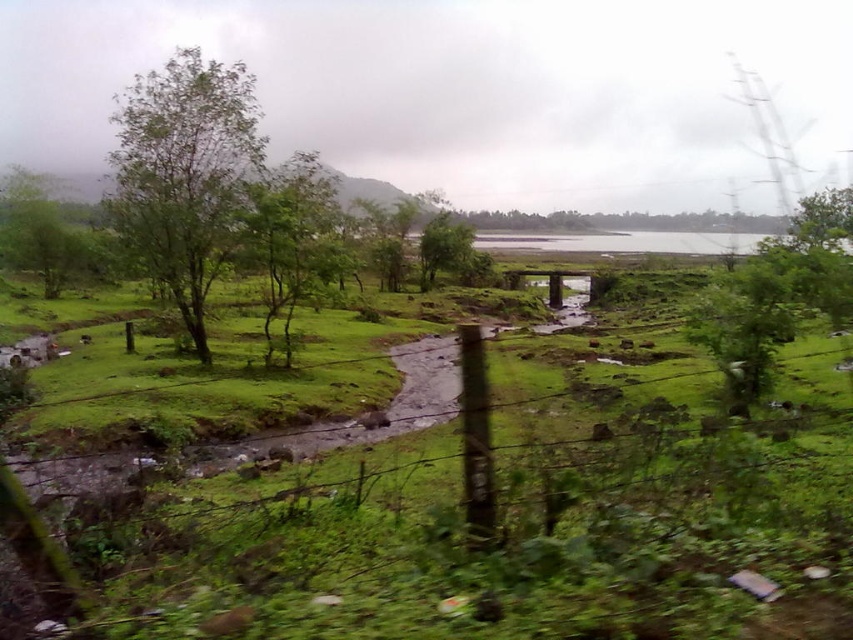
You are standing at the point marked as point (183, 173) in the image. Looking around, you see a green leafy tree at left and a barbed wire fence running diagonally across the middle ground. Which object is closer to you?

The green leafy tree at left is closer to you since the point (183, 173) is on it, whereas the barbed wire fence is further away in the middle ground.

You are standing at the center of the image and want to reach the green leafy tree at left. Which direction should you move in to get there?

To reach the green leafy tree at left, you should move to the left since it is located at point 0.272 on the x coordinate, which is to the left of the center point at 0.5.

You are standing in the middle of the barbed wire fence and want to walk towards the green leafy tree at left and the green leafy tree at center. Which tree will you reach first?

The green leafy tree at left is closer to the viewer than the green leafy tree at center, so you will reach the green leafy tree at left first.